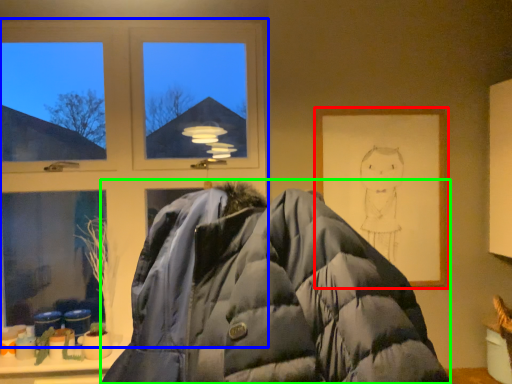
Question: Estimate the real-world distances between objects in this image. Which object is closer to picture frame (highlighted by a red box), window (highlighted by a blue box) or jacket (highlighted by a green box)?

Choices:
 (A) window
 (B) jacket

Answer: (A)